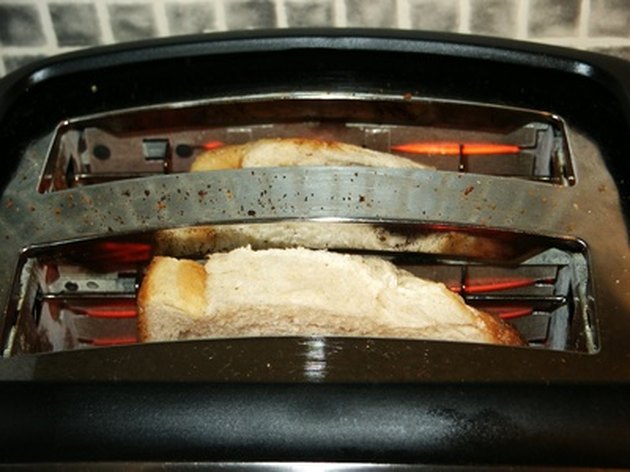
This screenshot has width=630, height=472. I want to click on heating element, so click(459, 141), click(501, 287), click(520, 319).